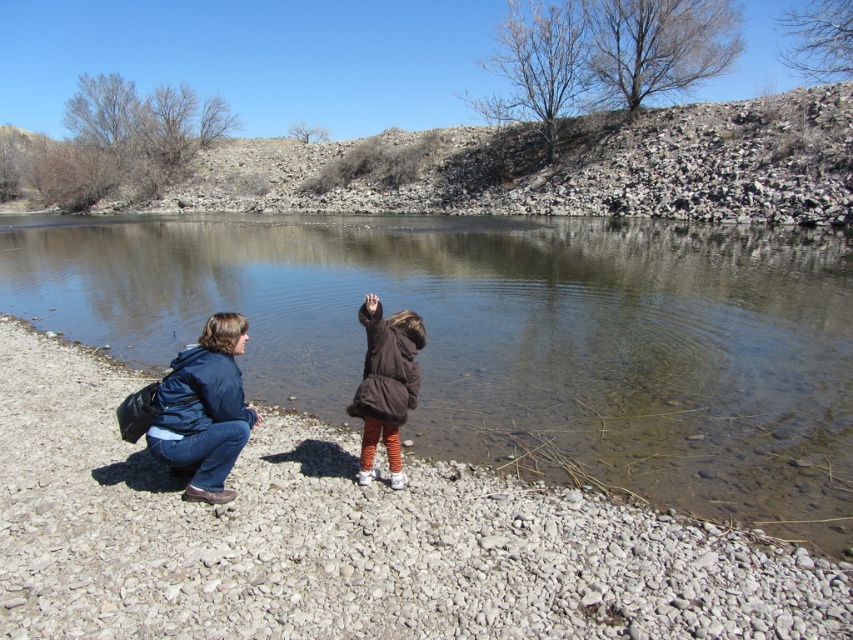
You are standing at the edge of the water and want to walk towards the gray gravel shore at lower left while avoiding the brown fuzzy coat at center. Which direction should you move from your current position?

The gray gravel shore at lower left is to the right of the brown fuzzy coat at center, so you should move to the right to reach the gray gravel shore at lower left while avoiding the brown fuzzy coat at center.

You are standing at the edge of the water and want to place a small rock on the gray gravel shore at lower left and the brown fuzzy coat at center. Which surface can accommodate the rock more comfortably?

The brown fuzzy coat at center is larger than the gray gravel shore at lower left, so the rock will fit more comfortably on the brown fuzzy coat at center.

You are standing at the point labeled point (229, 317) and want to walk to the point labeled point (376, 376). Which direction should you move to get closer to your destination?

You should move away from the viewer because point (229, 317) is closer to the viewer than point (376, 376).